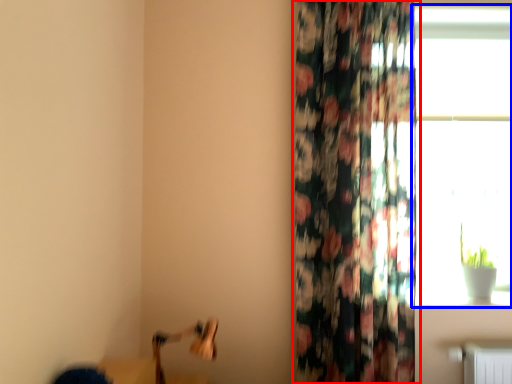
Question: Which object appears farthest to the camera in this image, curtain (highlighted by a red box) or window (highlighted by a blue box)?

Choices:
 (A) curtain
 (B) window

Answer: (B)